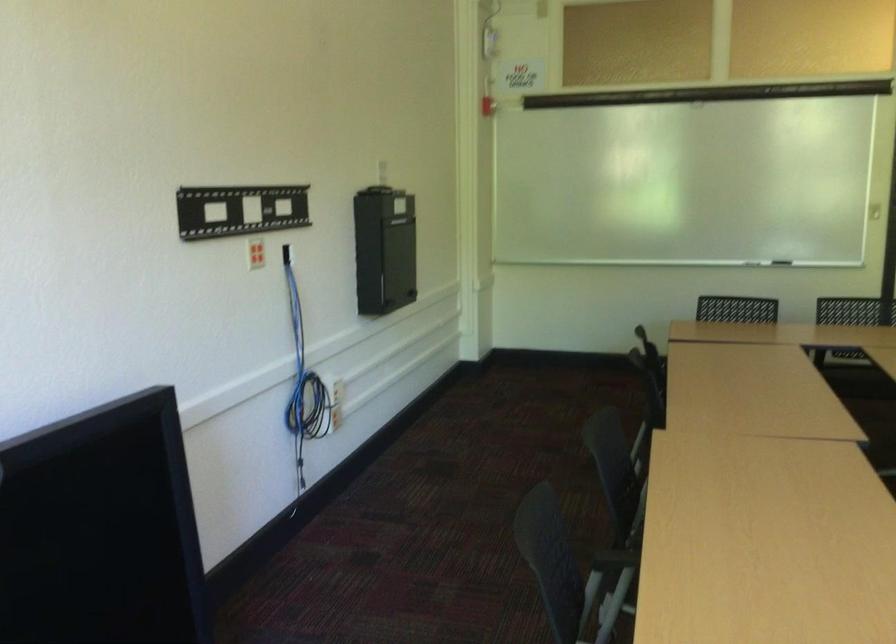
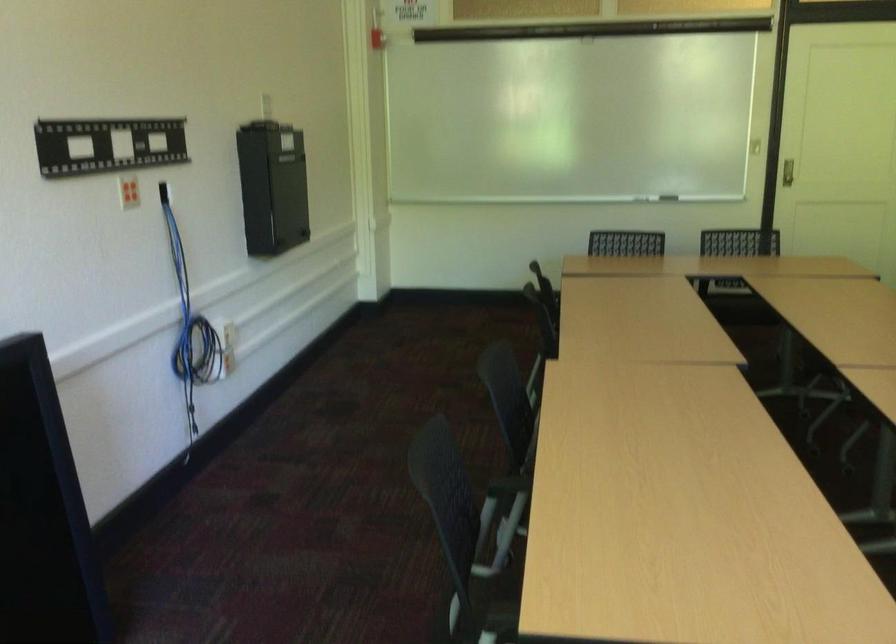
Question: The camera is either moving clockwise (left) or counter-clockwise (right) around the object. The first image is from the beginning of the video and the second image is from the end. Is the camera moving left or right when shooting the video?

Choices:
 (A) Left
 (B) Right

Answer: (A)